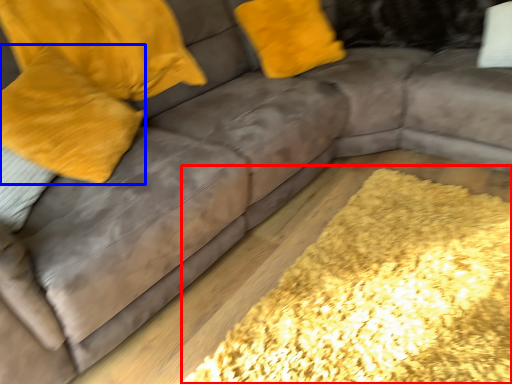
Question: Which object is closer to the camera taking this photo, mat (highlighted by a red box) or pillow (highlighted by a blue box)?

Choices:
 (A) mat
 (B) pillow

Answer: (A)